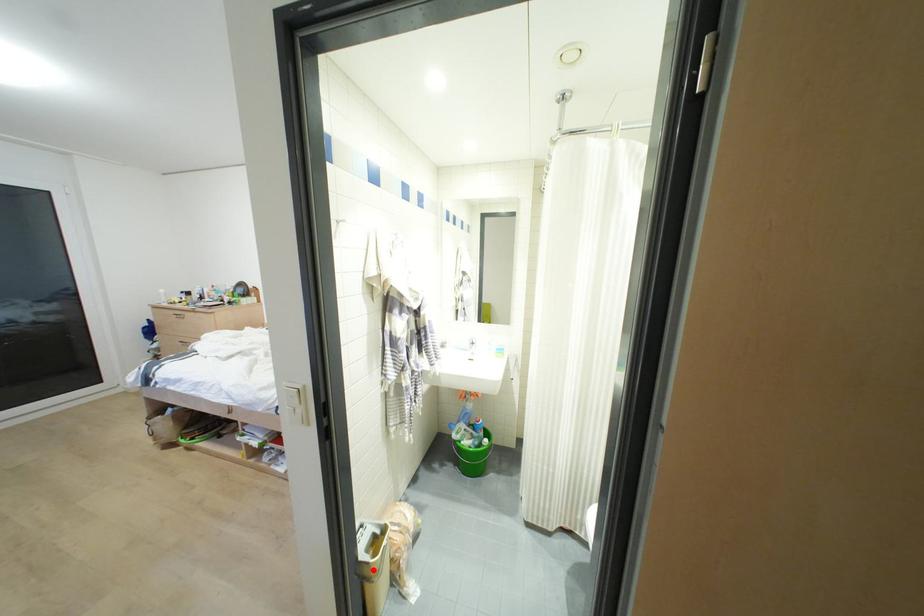
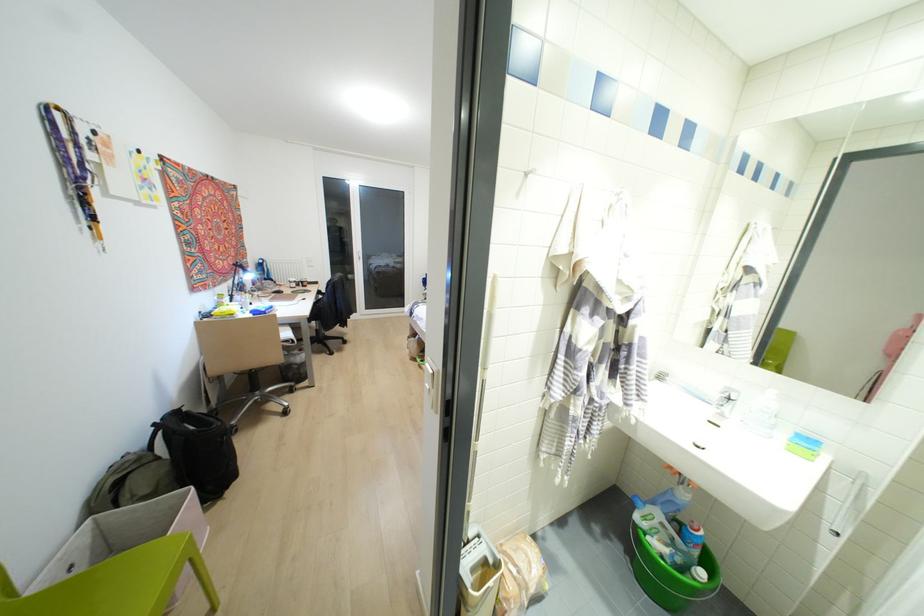
In the second image, find the point that corresponds to the highlighted location in the first image.

(469, 600)